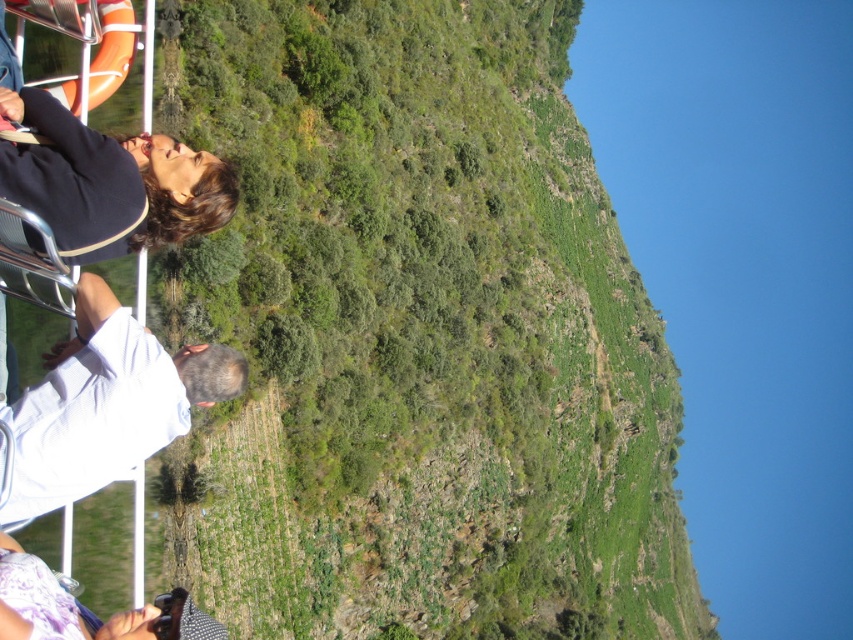
Question: Which point is farther from the camera taking this photo?

Choices:
 (A) (225, 177)
 (B) (537, 477)
 (C) (79, 433)

Answer: (B)

Question: Does green leafy hillside at upper left appear under white cotton shirt at lower left?

Choices:
 (A) no
 (B) yes

Answer: (B)

Question: Estimate the real-world distances between objects in this image. Which object is closer to the white cotton shirt at lower left?

Choices:
 (A) green leafy hillside at upper left
 (B) matte black shirt at left

Answer: (B)

Question: Is white cotton shirt at lower left smaller than matte black shirt at left?

Choices:
 (A) no
 (B) yes

Answer: (B)

Question: Which of the following is the farthest from the observer?

Choices:
 (A) (538, 253)
 (B) (97, 428)

Answer: (A)

Question: Can you confirm if white cotton shirt at lower left is smaller than matte black shirt at left?

Choices:
 (A) yes
 (B) no

Answer: (A)